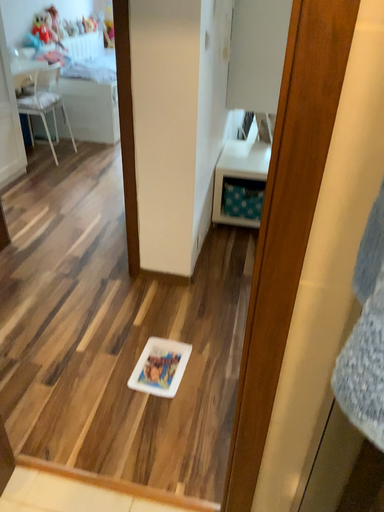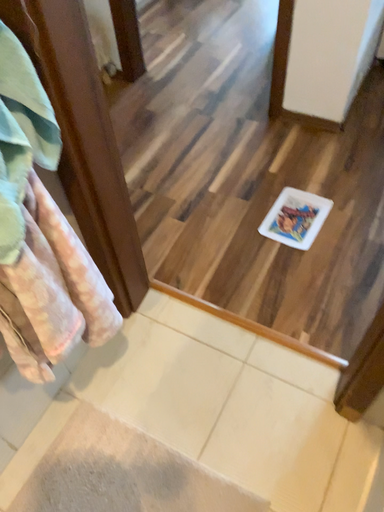
Question: How did the camera likely rotate when shooting the video?

Choices:
 (A) rotated upward
 (B) rotated downward

Answer: (B)